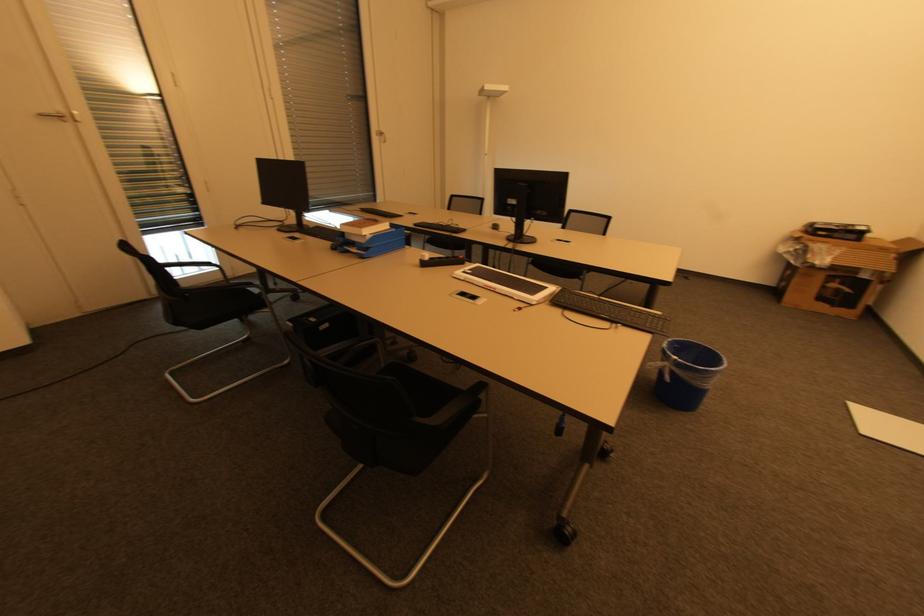
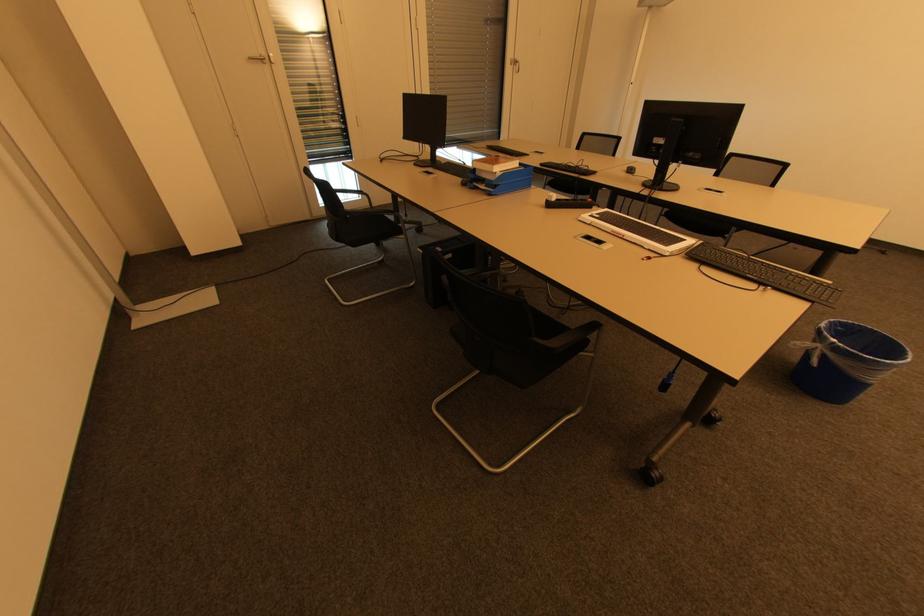
Find the pixel in the second image that matches (x=365, y=235) in the first image.

(495, 172)